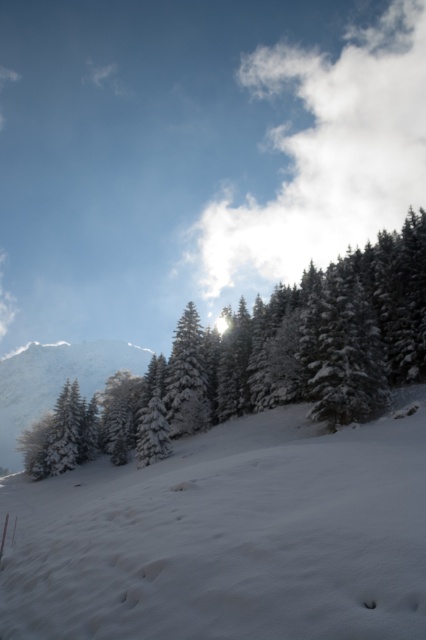
Question: Where is green matte evergreen tree at upper center located in relation to white frosty mountain at left in the image?

Choices:
 (A) left
 (B) right

Answer: (B)

Question: Which object appears farthest from the camera in this image?

Choices:
 (A) green matte evergreen tree at upper center
 (B) white snow at lower left
 (C) white frosty mountain at left

Answer: (C)

Question: Is white snow at lower left wider than white frosty mountain at left?

Choices:
 (A) no
 (B) yes

Answer: (A)

Question: Estimate the real-world distances between objects in this image. Which object is closer to the white frosty mountain at left?

Choices:
 (A) green matte evergreen tree at upper center
 (B) white snow at lower left

Answer: (A)

Question: Where is white snow at lower left located in relation to white frosty mountain at left in the image?

Choices:
 (A) below
 (B) above

Answer: (B)

Question: Which point is farther to the camera?

Choices:
 (A) white frosty mountain at left
 (B) green matte evergreen tree at upper center
 (C) white snow at lower left

Answer: (A)